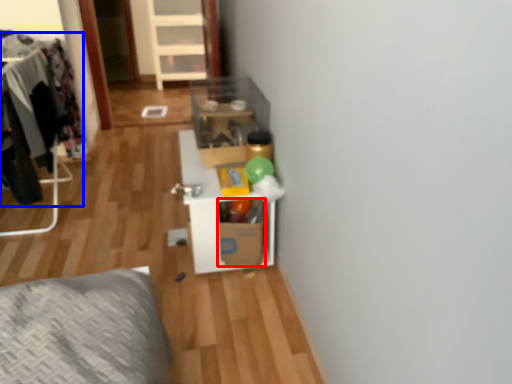
Question: Among these objects, which one is farthest to the camera, cardboard box (highlighted by a red box) or clothing (highlighted by a blue box)?

Choices:
 (A) cardboard box
 (B) clothing

Answer: (A)